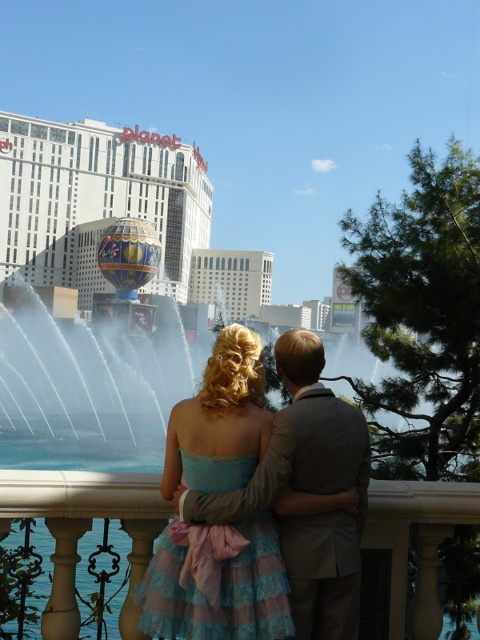
Question: Can you confirm if white glossy hotel at upper center is positioned to the right of white marble balustrade at lower center?

Choices:
 (A) no
 (B) yes

Answer: (A)

Question: Is white marble balustrade at lower center in front of light brown textured suit at center?

Choices:
 (A) yes
 (B) no

Answer: (A)

Question: Estimate the real-world distances between objects in this image. Which object is closer to the light brown textured suit at center?

Choices:
 (A) white glossy hotel at upper center
 (B) white marble balustrade at lower center

Answer: (B)

Question: Which of the following is the closest to the observer?

Choices:
 (A) light brown textured suit at center
 (B) white glossy hotel at upper center
 (C) white marble balustrade at lower center
 (D) teal satin dress at center

Answer: (D)

Question: Can you confirm if teal satin dress at center is thinner than white marble balustrade at lower center?

Choices:
 (A) yes
 (B) no

Answer: (A)

Question: Which of these objects is positioned closest to the light brown textured suit at center?

Choices:
 (A) white glossy hotel at upper center
 (B) white marble balustrade at lower center

Answer: (B)